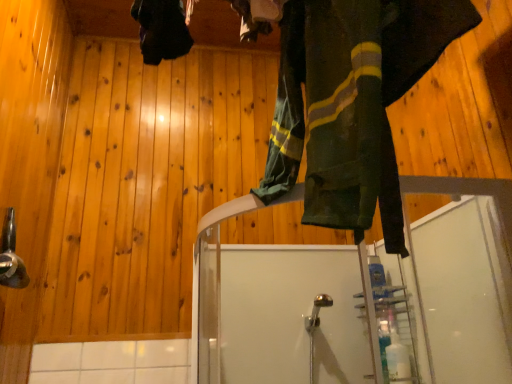
This screenshot has width=512, height=384. Describe the element at coordinates (11, 256) in the screenshot. I see `brushed metal shower head at left` at that location.

Where is `brushed metal shower head at left`? The width and height of the screenshot is (512, 384). brushed metal shower head at left is located at coordinates (11, 256).

The width and height of the screenshot is (512, 384). Describe the element at coordinates (352, 103) in the screenshot. I see `green fabric pants at upper center` at that location.

Identify the location of green fabric pants at upper center. This screenshot has width=512, height=384. (352, 103).

Looking at this image, what is the approximate width of green fabric pants at upper center?

The width of green fabric pants at upper center is 9.93 inches.

Locate an element on the screen. The height and width of the screenshot is (384, 512). brushed metal shower head at left is located at coordinates (11, 256).

Between green fabric pants at upper center and brushed metal shower head at left, which one appears on the left side from the viewer's perspective?

From the viewer's perspective, brushed metal shower head at left appears more on the left side.

Is the depth of green fabric pants at upper center greater than that of brushed metal shower head at left?

That is False.

Considering the points (323, 182) and (8, 257), which point is behind, point (323, 182) or point (8, 257)?

The point (8, 257) is farther from the camera.

From the image's perspective, would you say green fabric pants at upper center is positioned over brushed metal shower head at left?

Correct, green fabric pants at upper center appears higher than brushed metal shower head at left in the image.

From a real-world perspective, who is located higher, green fabric pants at upper center or brushed metal shower head at left?

From a 3D spatial view, green fabric pants at upper center is above.

Considering the relative sizes of green fabric pants at upper center and brushed metal shower head at left in the image provided, is green fabric pants at upper center thinner than brushed metal shower head at left?

No, green fabric pants at upper center is not thinner than brushed metal shower head at left.

Considering the relative sizes of green fabric pants at upper center and brushed metal shower head at left in the image provided, is green fabric pants at upper center shorter than brushed metal shower head at left?

No.

Who is bigger, green fabric pants at upper center or brushed metal shower head at left?

With larger size is green fabric pants at upper center.

Is brushed metal shower head at left surrounded by green fabric pants at upper center?

No, brushed metal shower head at left is not a part of green fabric pants at upper center.

Is green fabric pants at upper center not close to brushed metal shower head at left?

Yes, green fabric pants at upper center is far from brushed metal shower head at left.

Does green fabric pants at upper center turn towards brushed metal shower head at left?

Yes, green fabric pants at upper center is oriented towards brushed metal shower head at left.

Can you tell me how much green fabric pants at upper center and brushed metal shower head at left differ in facing direction?

green fabric pants at upper center and brushed metal shower head at left are facing 179 degrees away from each other.

At what (x,y) coordinates should I click in order to perform the action: click on clothing in front of the brushed metal shower head at left. Please return your answer as a coordinate pair (x, y). The width and height of the screenshot is (512, 384). Looking at the image, I should click on (352, 103).

Can you confirm if brushed metal shower head at left is positioned to the right of green fabric pants at upper center?

No, brushed metal shower head at left is not to the right of green fabric pants at upper center.

Is brushed metal shower head at left positioned behind green fabric pants at upper center?

Yes, it is.

Between point (9, 244) and point (306, 86), which one is positioned behind?

The point (9, 244) is farther.

From the image's perspective, is brushed metal shower head at left located beneath green fabric pants at upper center?

Yes, from the image's perspective, brushed metal shower head at left is beneath green fabric pants at upper center.

From a real-world perspective, who is located higher, brushed metal shower head at left or green fabric pants at upper center?

green fabric pants at upper center is physically above.

Consider the image. Considering the sizes of objects brushed metal shower head at left and green fabric pants at upper center in the image provided, who is wider, brushed metal shower head at left or green fabric pants at upper center?

green fabric pants at upper center.

Consider the image. Considering the relative sizes of brushed metal shower head at left and green fabric pants at upper center in the image provided, is brushed metal shower head at left shorter than green fabric pants at upper center?

Indeed, brushed metal shower head at left has a lesser height compared to green fabric pants at upper center.

Which of these two, brushed metal shower head at left or green fabric pants at upper center, is smaller?

Smaller between the two is brushed metal shower head at left.

Is brushed metal shower head at left outside of green fabric pants at upper center?

Indeed, brushed metal shower head at left is completely outside green fabric pants at upper center.

Is brushed metal shower head at left far away from green fabric pants at upper center?

Absolutely, brushed metal shower head at left is distant from green fabric pants at upper center.

Is brushed metal shower head at left aimed at green fabric pants at upper center?

No, brushed metal shower head at left is not oriented towards green fabric pants at upper center.

How distant is brushed metal shower head at left from green fabric pants at upper center?

brushed metal shower head at left and green fabric pants at upper center are 1.09 meters apart from each other.

I want to click on shower located behind the green fabric pants at upper center, so click(11, 256).

Locate an element on the screen. shower on the left of the green fabric pants at upper center is located at coordinates (11, 256).

Identify the location of clothing above the brushed metal shower head at left (from the image's perspective). (352, 103).